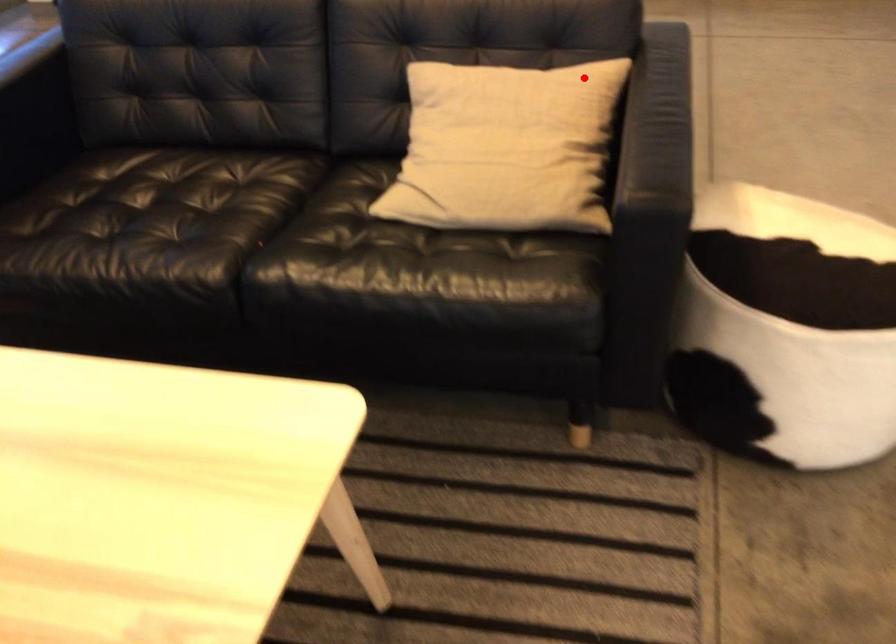
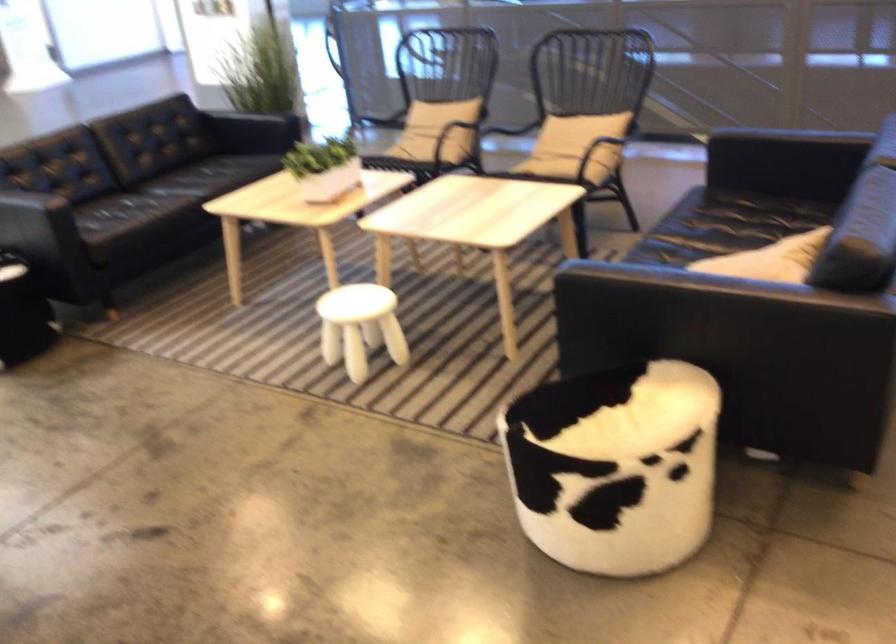
Question: A red point is marked in image1. In image2, is the corresponding 3D point closer to the camera or farther? Reply with the corresponding letter.

Choices:
 (A) The corresponding 3D point is closer.
 (B) The corresponding 3D point is farther.

Answer: (B)